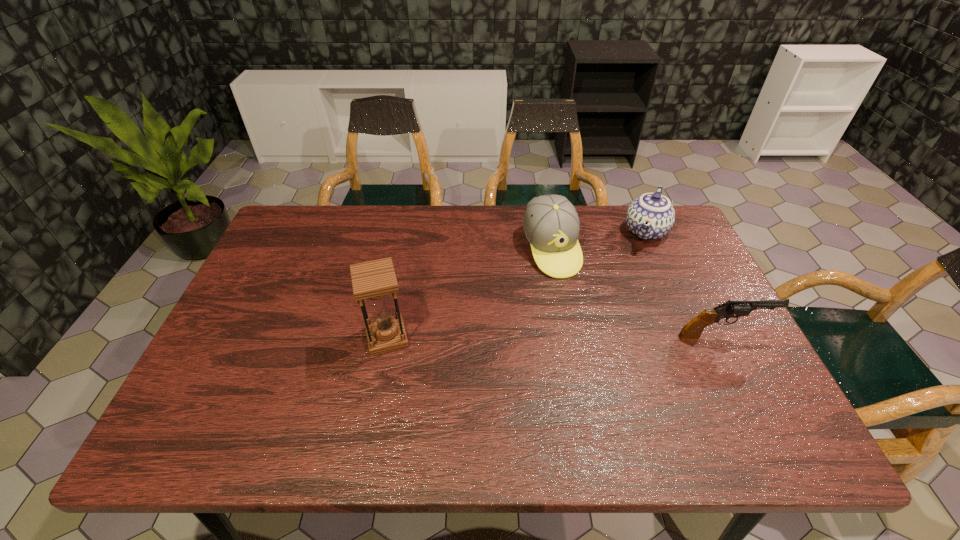
Find the location of a particular element. The image size is (960, 540). the tallest object is located at coordinates (374, 281).

This screenshot has width=960, height=540. What are the coordinates of `the leftmost object` in the screenshot? It's located at (374, 281).

Identify the location of gun. Image resolution: width=960 pixels, height=540 pixels. (693, 329).

Where is `baseball cap`? The width and height of the screenshot is (960, 540). baseball cap is located at coordinates (551, 224).

The image size is (960, 540). In order to click on chinaware in this screenshot , I will do `click(651, 216)`.

The height and width of the screenshot is (540, 960). In order to click on vacant space situated 0.250m on the back of the hourglass in this screenshot , I will do `click(402, 256)`.

Locate an element on the screen. vacant space located on the front-facing side of the baseball cap is located at coordinates (611, 395).

I want to click on free space located 0.190m on the front-facing side of the baseball cap, so click(x=583, y=330).

At what (x,y) coordinates should I click in order to perform the action: click on vacant region located on the front-facing side of the baseball cap. Please return your answer as a coordinate pair (x, y). Image resolution: width=960 pixels, height=540 pixels. Looking at the image, I should click on (594, 355).

Where is `vacant position located 0.320m from the spout of the chinaware`? The height and width of the screenshot is (540, 960). vacant position located 0.320m from the spout of the chinaware is located at coordinates (611, 321).